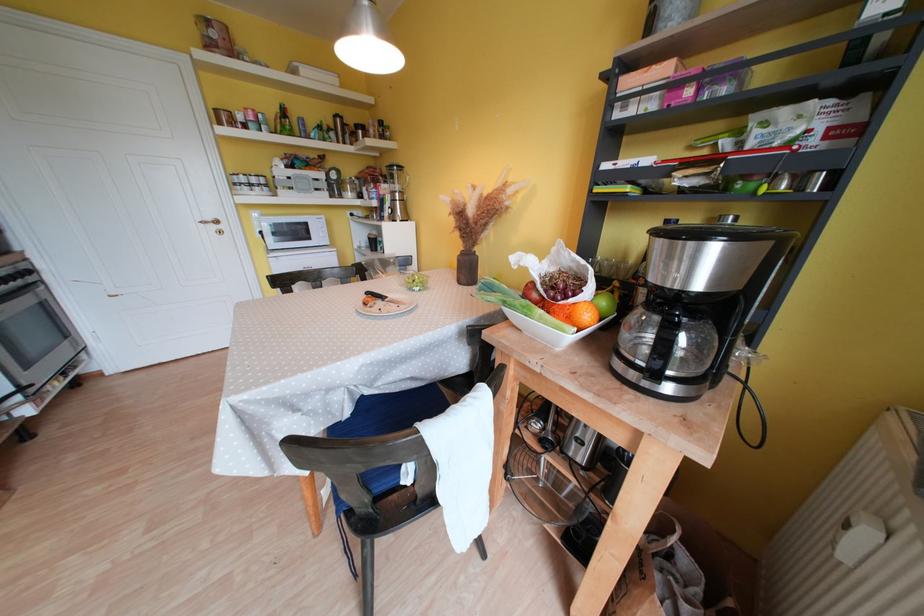
Where would you turn the white door handle? Please return your answer as a coordinate pair (x, y).

(213, 224)